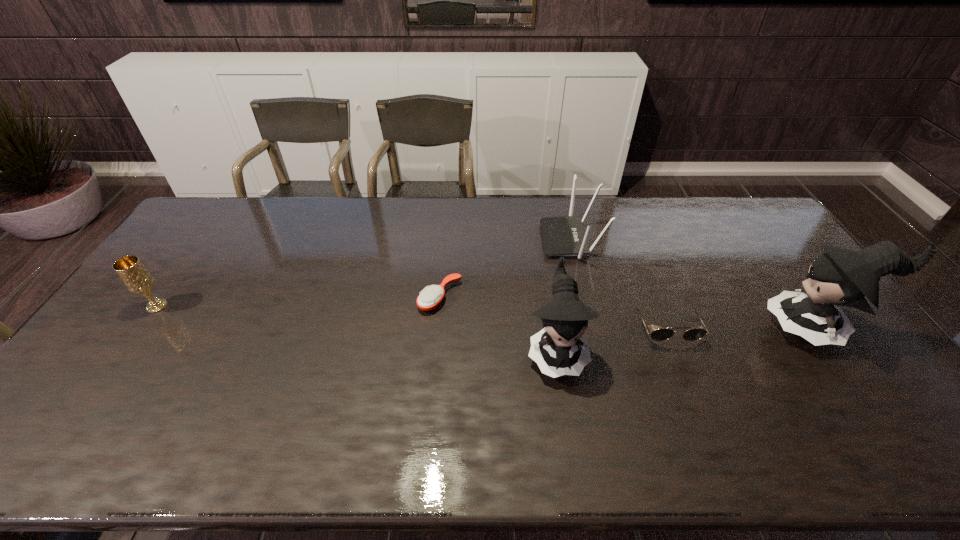
I want to click on blank area located 0.050m at the face of the shorter doll, so click(564, 404).

Identify the location of free space located at the face of the right doll. The image size is (960, 540). (708, 328).

You are a GUI agent. You are given a task and a screenshot of the screen. Output one action in this format:
    pyautogui.click(x=<x>, y=<y>)
    Task: Click on the vacant area located 0.140m at the face of the right doll
    The width and height of the screenshot is (960, 540).
    Given the screenshot: What is the action you would take?
    pyautogui.click(x=716, y=328)

The width and height of the screenshot is (960, 540). In order to click on vacant space positioned 0.330m at the face of the right doll in this screenshot , I will do `click(649, 328)`.

You are a GUI agent. You are given a task and a screenshot of the screen. Output one action in this format:
    pyautogui.click(x=<x>, y=<y>)
    Task: Click on the vacant space located 0.050m on the front lenses of the second object from right to left
    
    Given the screenshot: What is the action you would take?
    pyautogui.click(x=679, y=362)

Locate an element on the screen. vacant area located 0.070m on the right of the second object from left to right is located at coordinates (484, 297).

The image size is (960, 540). I want to click on vacant area located 0.110m on the front-facing side of the router, so click(x=511, y=240).

Where is `vacant region located on the front-facing side of the router`? vacant region located on the front-facing side of the router is located at coordinates (462, 240).

At what (x,y) coordinates should I click in order to perform the action: click on free space located 0.330m on the front-facing side of the router. Please return your answer as a coordinate pair (x, y). Image resolution: width=960 pixels, height=540 pixels. Looking at the image, I should click on (447, 240).

Locate an element on the screen. vacant space positioned on the left of the leftmost object is located at coordinates (126, 306).